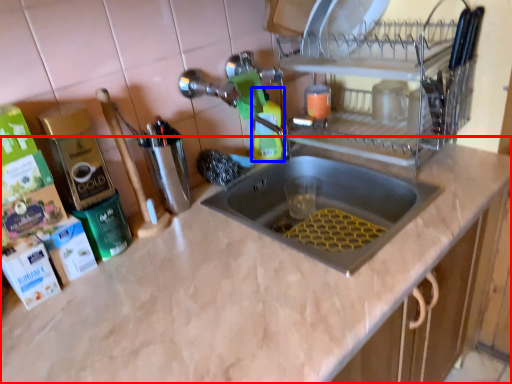
Question: Which of the following is the farthest to the observer, countertop (highlighted by a red box) or cleaning product (highlighted by a blue box)?

Choices:
 (A) countertop
 (B) cleaning product

Answer: (B)